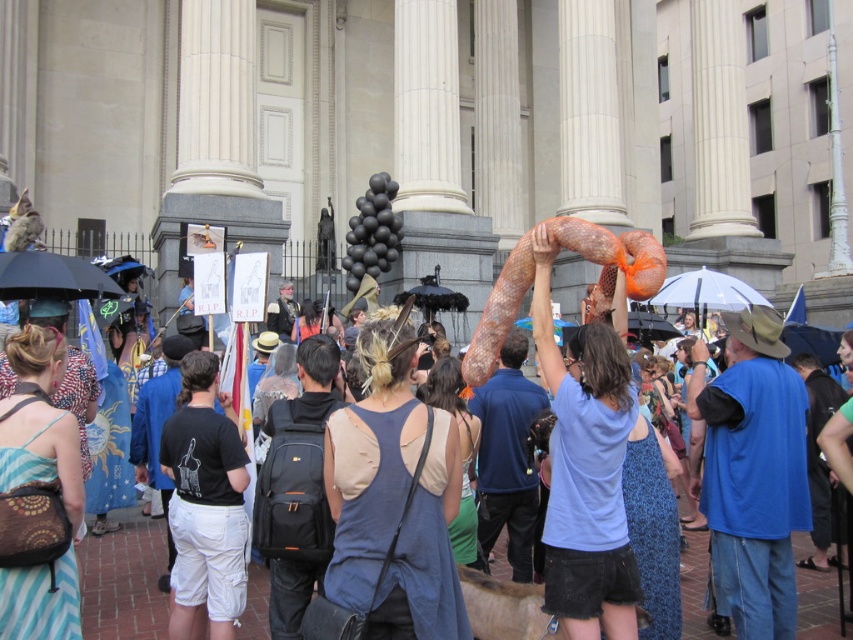
Does light blue cotton shirt at upper center have a lesser height compared to transparent plastic umbrella at upper center?

No.

Does light blue cotton shirt at upper center appear on the right side of transparent plastic umbrella at upper center?

No, light blue cotton shirt at upper center is not to the right of transparent plastic umbrella at upper center.

Between point (618, 376) and point (683, 273), which one is positioned in front?

Point (618, 376)

This screenshot has width=853, height=640. I want to click on light blue cotton shirt at upper center, so click(x=585, y=468).

Is point (112, 284) farther from camera compared to point (680, 289)?

No, it is in front of (680, 289).

Who is lower down, black matte umbrella at left or transparent plastic umbrella at upper center?

black matte umbrella at left

Which is behind, point (28, 291) or point (676, 291)?

Point (676, 291)

This screenshot has height=640, width=853. Identify the location of black matte umbrella at left. (51, 276).

Does light blue cotton shirt at upper center have a greater height compared to black matte umbrella at left?

Yes, light blue cotton shirt at upper center is taller than black matte umbrella at left.

Between point (613, 429) and point (38, 294), which one is positioned behind?

Point (38, 294)

At what (x,y) coordinates should I click in order to perform the action: click on light blue cotton shirt at upper center. Please return your answer as a coordinate pair (x, y). This screenshot has width=853, height=640. Looking at the image, I should click on [585, 468].